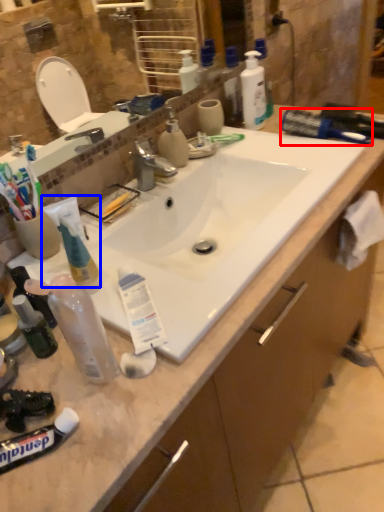
Question: Which object appears farthest to the camera in this image, brush (highlighted by a red box) or toothpaste (highlighted by a blue box)?

Choices:
 (A) brush
 (B) toothpaste

Answer: (A)